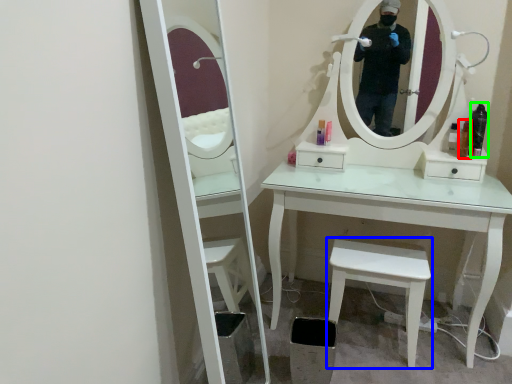
Question: Which object is positioned farthest from toiletry (highlighted by a red box)? Select from stool (highlighted by a blue box) and toiletry (highlighted by a green box).

Choices:
 (A) stool
 (B) toiletry

Answer: (A)